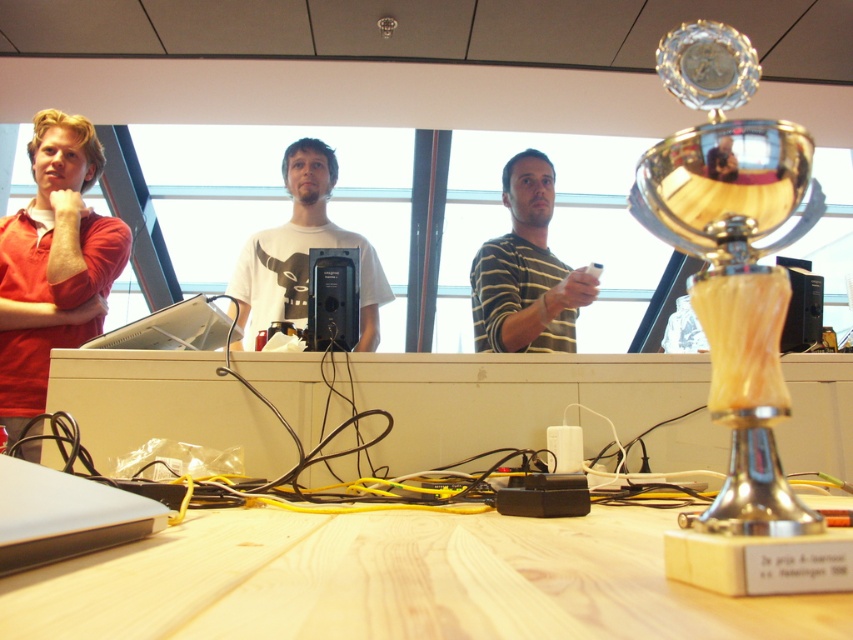
You are organizing a photo shoot and need to ensure that the matte red shirt at left and the white plastic laptop at center are clearly visible in the frame. Given their sizes, which object should you focus on first to ensure proper lighting?

The matte red shirt at left is bigger than the white plastic laptop at center, so you should focus on lighting the matte red shirt at left first to ensure its details are captured properly.

You are a delivery person who needs to place a small package on the counter between the matte red shirt at left and the white plastic laptop at center. The package is 18 inches long. Can you fit it horizontally between them without moving either object?

The distance between the matte red shirt at left and the white plastic laptop at center is 17.61 inches. Since the package is 18 inches long, it cannot fit horizontally between them without moving either object.

You are organizing items on the wooden table and need to place the gold polished trophy at right and the white plastic laptop at center. Which object requires more horizontal space on the table?

The white plastic laptop at center requires more horizontal space on the table since it has a greater width than the gold polished trophy at right.